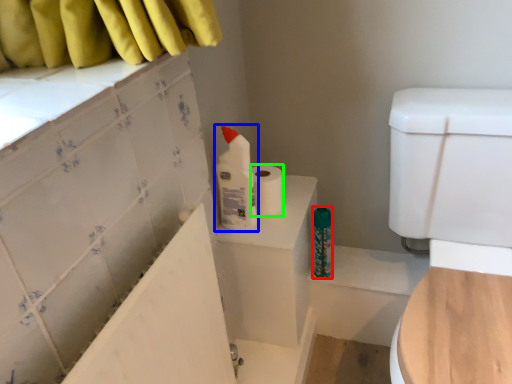
Question: Which is nearer to the toiletry (highlighted by a red box)? cleaning product (highlighted by a blue box) or toilet paper (highlighted by a green box).

Choices:
 (A) cleaning product
 (B) toilet paper

Answer: (B)